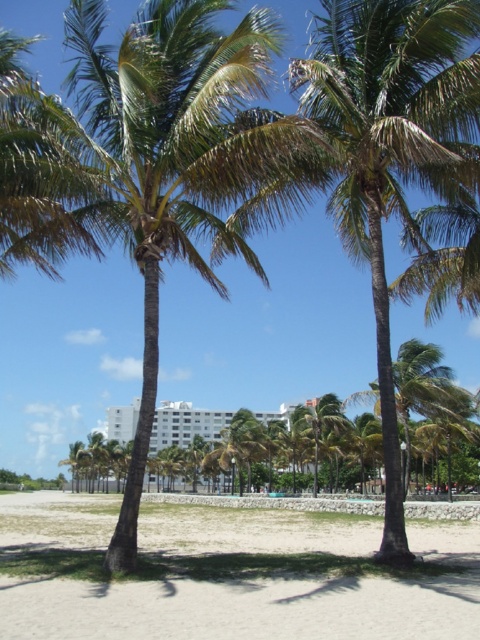
Question: Can you confirm if beige sandy beach at center is positioned to the right of white smooth building at center?

Choices:
 (A) no
 (B) yes

Answer: (A)

Question: Is green leafy palm tree at center to the right of white smooth building at center from the viewer's perspective?

Choices:
 (A) no
 (B) yes

Answer: (A)

Question: Which is nearer to the white smooth building at center?

Choices:
 (A) green leafy palm tree at center
 (B) beige sandy beach at center

Answer: (B)

Question: Which point is closer to the camera?

Choices:
 (A) (25, 96)
 (B) (110, 528)
 (C) (132, 420)

Answer: (A)

Question: Which point is closer to the camera?

Choices:
 (A) (194, 406)
 (B) (196, 74)
 (C) (231, 600)

Answer: (C)

Question: Can you confirm if green leafy palm tree at center is positioned below beige sandy beach at center?

Choices:
 (A) no
 (B) yes

Answer: (A)